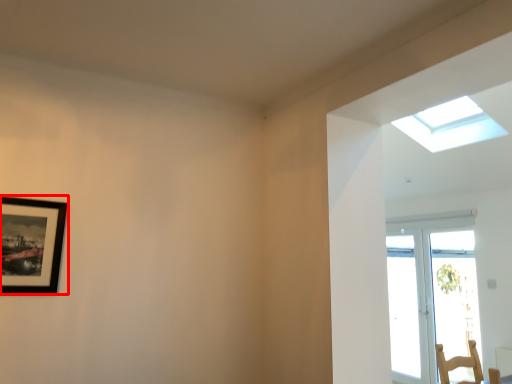
Question: From the image, what is the correct spatial relationship of picture frame (annotated by the red box) in relation to window?

Choices:
 (A) right
 (B) left

Answer: (B)